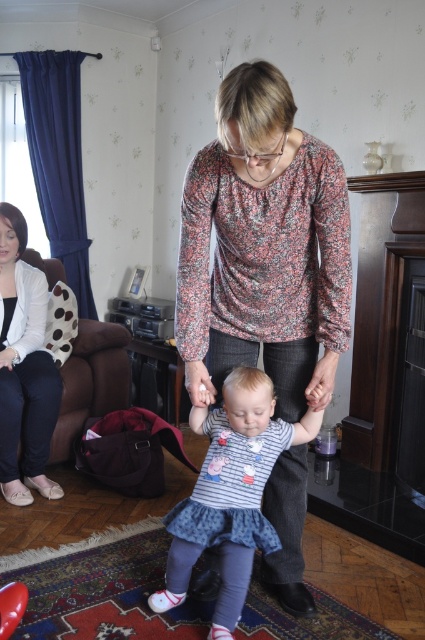
Question: Does denim dress at center lie behind brown fabric armchair at left?

Choices:
 (A) no
 (B) yes

Answer: (A)

Question: Does floral print blouse at center have a smaller size compared to denim dress at center?

Choices:
 (A) yes
 (B) no

Answer: (B)

Question: From the image, what is the correct spatial relationship of floral print blouse at center in relation to denim dress at center?

Choices:
 (A) right
 (B) left

Answer: (A)

Question: Among these objects, which one is nearest to the camera?

Choices:
 (A) matte white sweater at left
 (B) floral print blouse at center
 (C) brown fabric armchair at left
 (D) denim dress at center

Answer: (B)

Question: Which object appears closest to the camera in this image?

Choices:
 (A) denim dress at center
 (B) brown fabric armchair at left

Answer: (A)

Question: Which of these objects is positioned farthest from the matte white sweater at left?

Choices:
 (A) brown fabric armchair at left
 (B) floral print blouse at center
 (C) denim dress at center

Answer: (B)